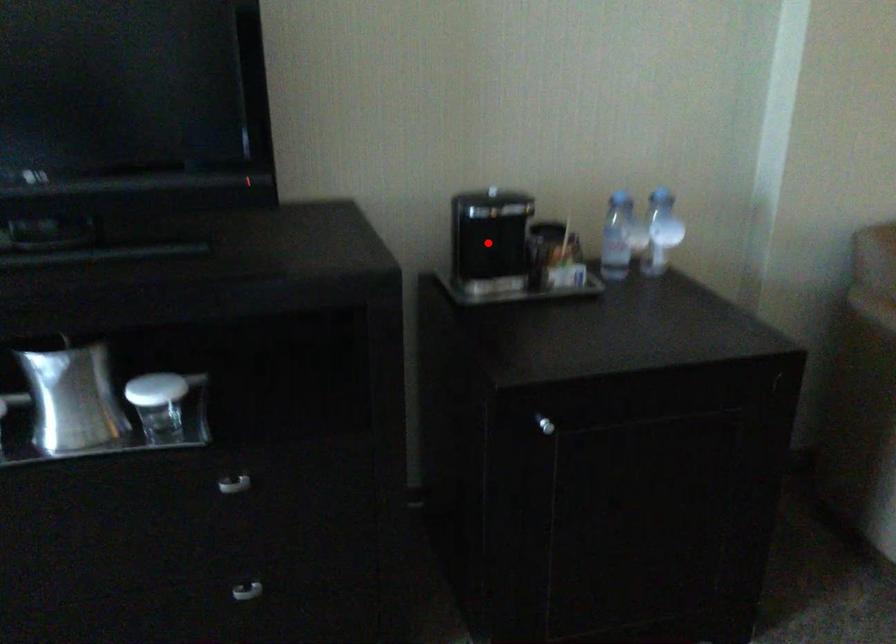
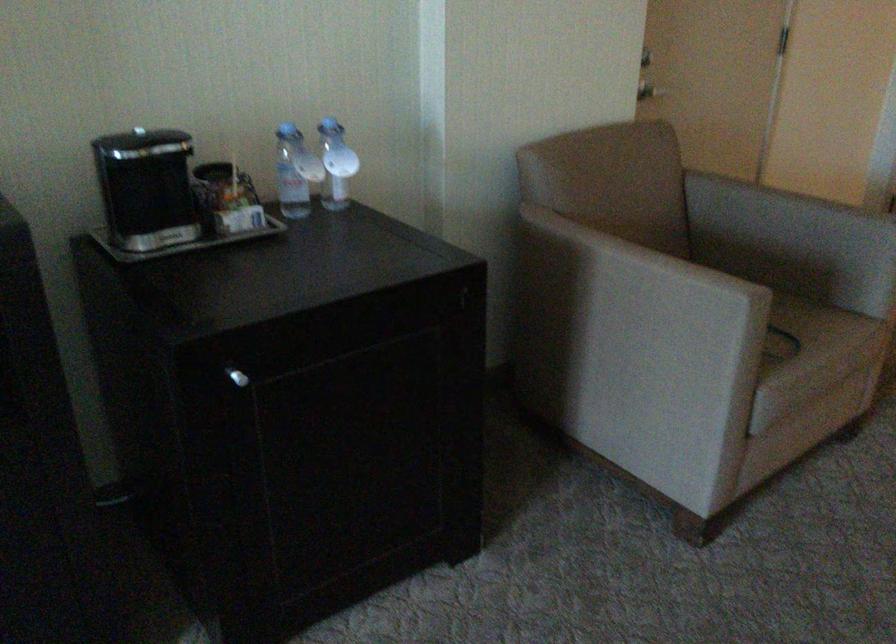
Question: I am providing you with two images of the same scene from different viewpoints. Image1 has a red point marked. In image2, the corresponding 3D location appears at what relative position? Reply with the corresponding letter.

Choices:
 (A) Closer
 (B) Farther

Answer: (A)